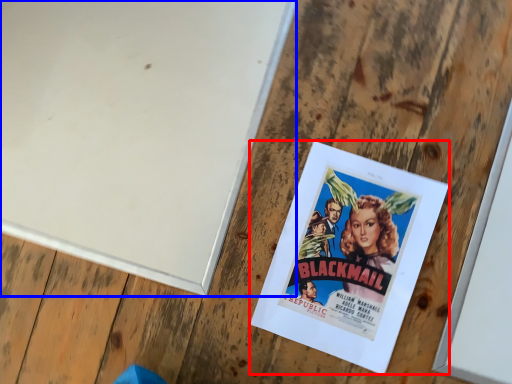
Question: Which object is closer to the camera taking this photo, poster (highlighted by a red box) or bulletin board (highlighted by a blue box)?

Choices:
 (A) poster
 (B) bulletin board

Answer: (A)